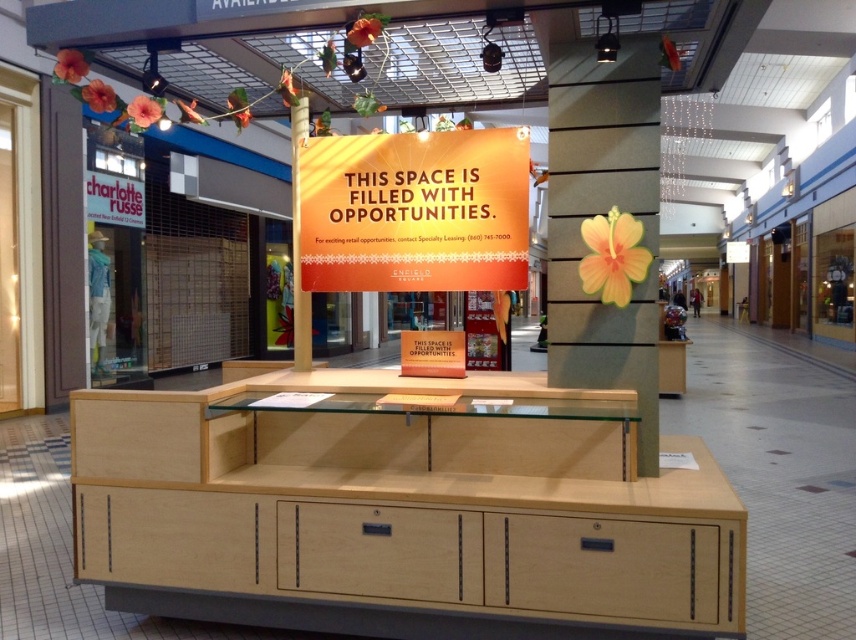
You are standing in the shopping mall and want to locate the matte gray pillar at center. According to the coordinates given, where should you look?

The matte gray pillar at center is located at coordinates point (603, 214).

You are a store designer planning to install a new display in the mall. You have a tall sculpture that needs to be placed near the matte gray pillar at center and light wood drawer at center. Which object should you place the sculpture next to if you want it to be taller than both?

The sculpture should be placed next to the light wood drawer at center because the matte gray pillar at center is much taller than the light wood drawer at center, so the sculpture needs to be taller than the pillar to surpass both. However, since the pillar is already the taller one, placing the sculpture next to the lighter wood drawer would allow it to be taller than the drawer while still being shorter than the pillar. Alternatively, if the sculpture must be taller than both, it needs to exceed the pill